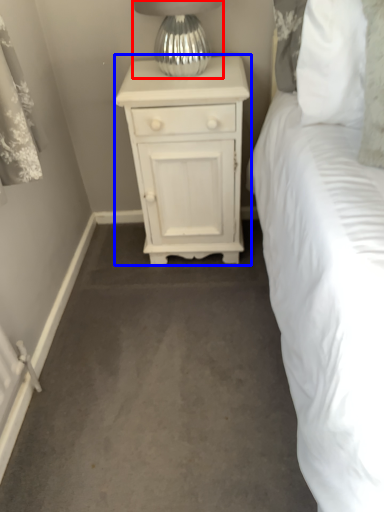
Question: Which object is further to the camera taking this photo, table lamp (highlighted by a red box) or nightstand (highlighted by a blue box)?

Choices:
 (A) table lamp
 (B) nightstand

Answer: (B)